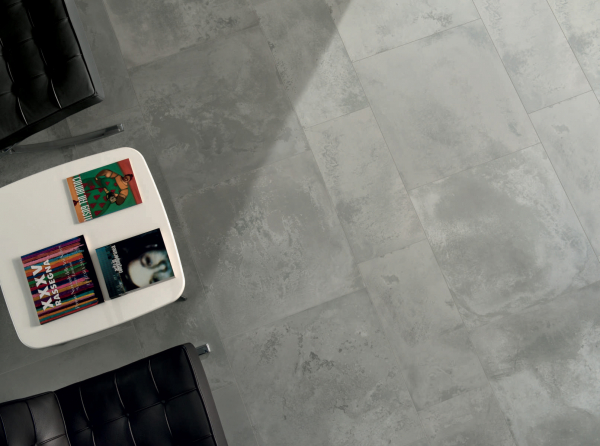
Where is `chair legs`? This screenshot has width=600, height=446. chair legs is located at coordinates (208, 350), (119, 130).